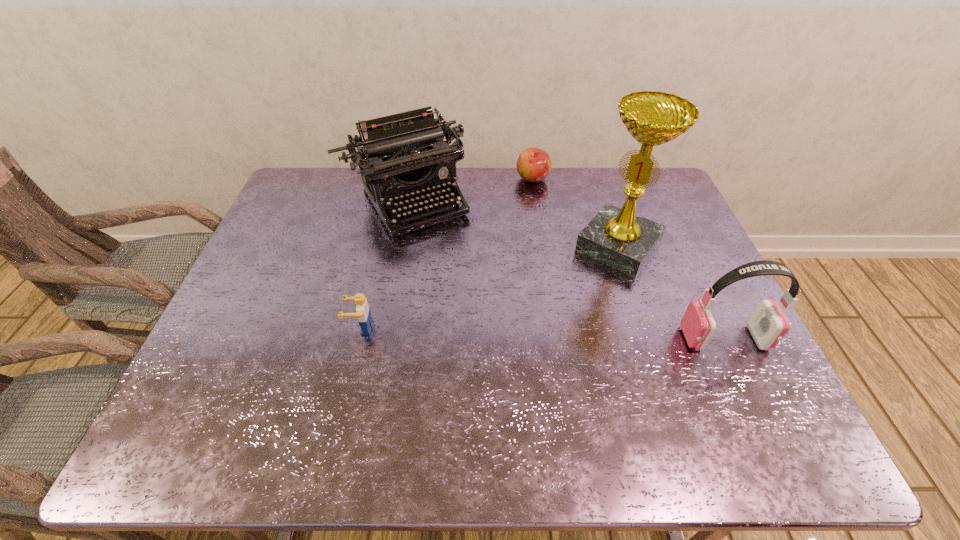
Identify the location of apple that is at the far edge. The width and height of the screenshot is (960, 540). (534, 164).

At what (x,y) coordinates should I click in order to perform the action: click on typewriter situated at the far edge. Please return your answer as a coordinate pair (x, y). Image resolution: width=960 pixels, height=540 pixels. Looking at the image, I should click on (402, 155).

Find the location of a particular element. The image size is (960, 540). earphone located at the right edge is located at coordinates (767, 324).

At what (x,y) coordinates should I click in order to perform the action: click on award that is at the right edge. Please return your answer as a coordinate pair (x, y). The width and height of the screenshot is (960, 540). Looking at the image, I should click on (617, 237).

The height and width of the screenshot is (540, 960). In the image, there is a desktop. Identify the location of free space at the far edge. [568, 205].

The image size is (960, 540). In the image, there is a desktop. Identify the location of free space at the near edge. (416, 383).

Find the location of a particular element. The height and width of the screenshot is (540, 960). vacant space at the left edge is located at coordinates (320, 210).

This screenshot has width=960, height=540. What are the coordinates of `vacant point at the far left corner` in the screenshot? It's located at (345, 168).

Identify the location of vacant region between the Lego and the tallest object. The image size is (960, 540). (490, 287).

What are the coordinates of `free space between the Lego and the earphone` in the screenshot? It's located at (542, 333).